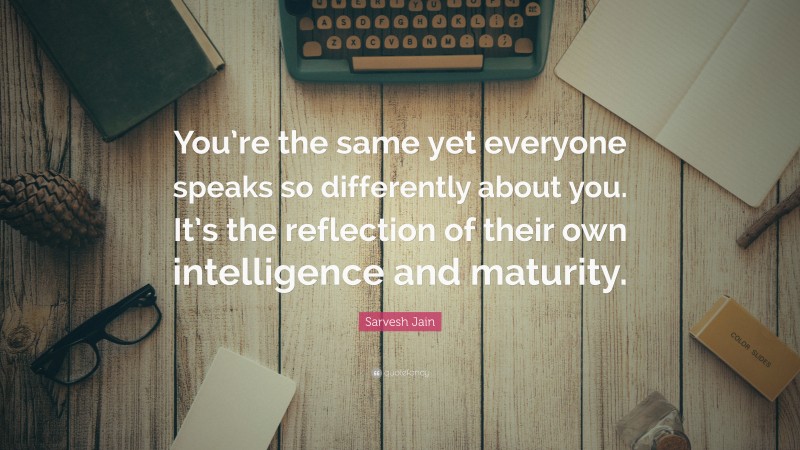
Where is `book`? This screenshot has width=800, height=450. book is located at coordinates (130, 32).